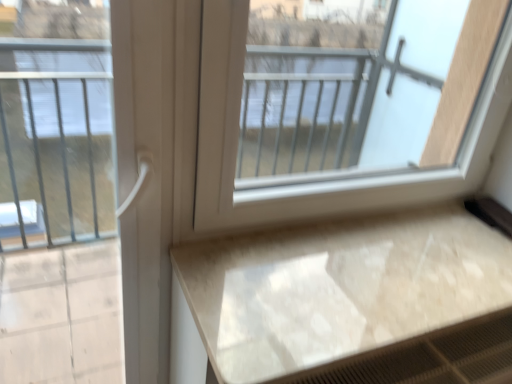
Describe the element at coordinates (356, 299) in the screenshot. I see `white marble counter at center` at that location.

This screenshot has width=512, height=384. I want to click on white marble counter at center, so click(356, 299).

Find the location of a particular element. This screenshot has width=512, height=384. white marble counter at center is located at coordinates (356, 299).